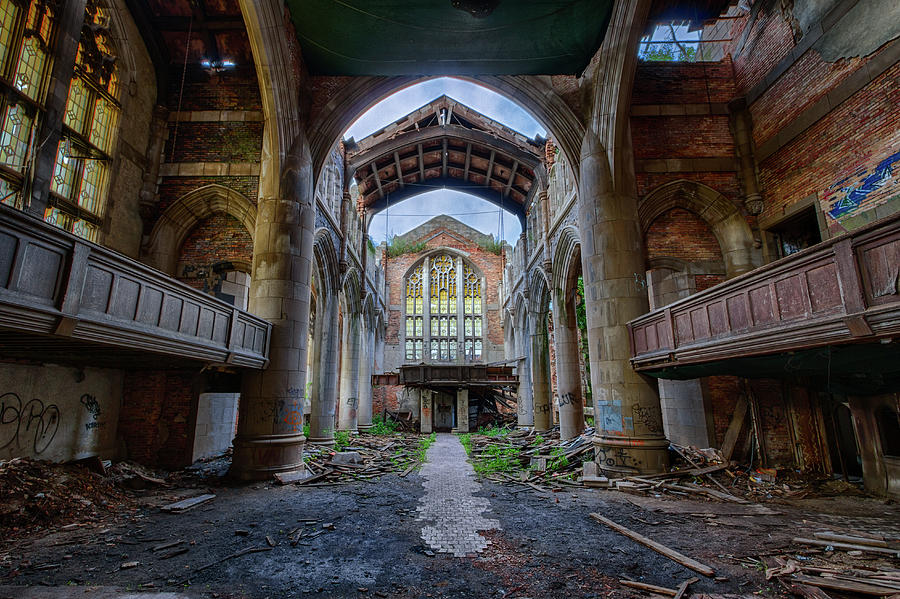
Identify the location of pillar. This screenshot has width=900, height=599. (639, 411).